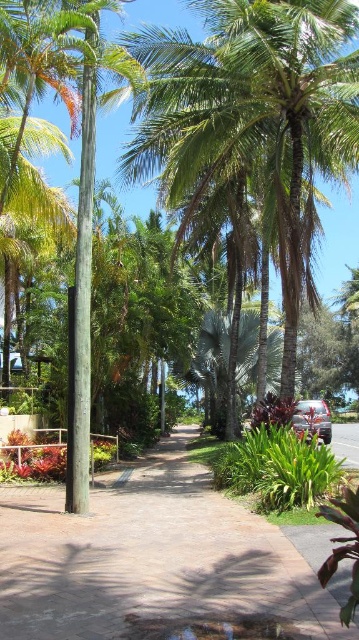
Question: Which is nearer to the brown concrete pavement at center?

Choices:
 (A) metallic silver car at center
 (B) green leafy palm tree at center

Answer: (A)

Question: Does green matte pole at center have a greater width compared to metallic silver car at center?

Choices:
 (A) no
 (B) yes

Answer: (A)

Question: Is green leafy palm tree at center above green matte pole at center?

Choices:
 (A) no
 (B) yes

Answer: (B)

Question: Which point is closer to the camera?

Choices:
 (A) metallic silver car at center
 (B) green leafy palm tree at center
 (C) brown concrete pavement at center
 (D) green matte pole at center

Answer: (C)

Question: Which is farther from the green leafy palm tree at center?

Choices:
 (A) brown concrete pavement at center
 (B) green matte pole at center

Answer: (A)

Question: Can you confirm if brown concrete pavement at center is smaller than green matte pole at center?

Choices:
 (A) yes
 (B) no

Answer: (B)